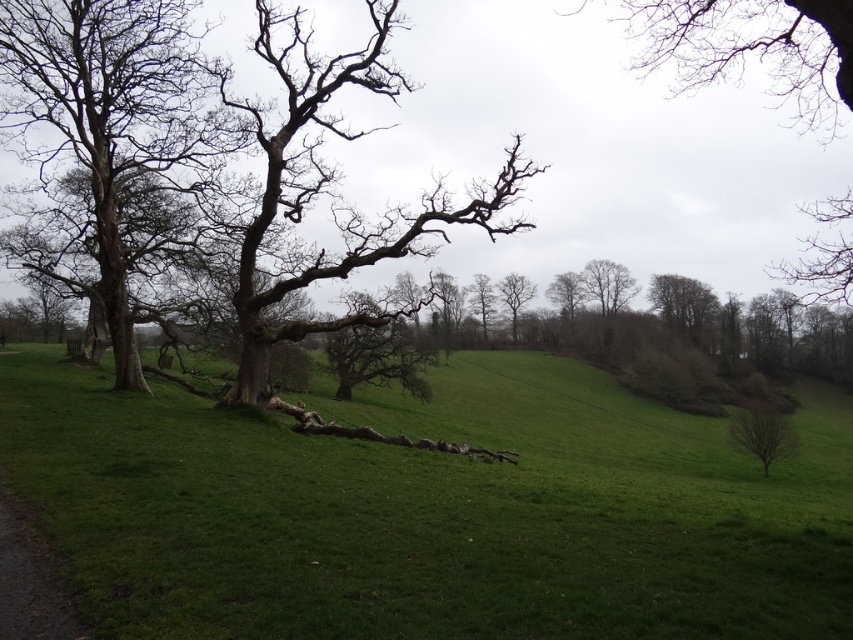
Which is in front, point (834, 273) or point (505, 282)?

Positioned in front is point (834, 273).

This screenshot has height=640, width=853. What do you see at coordinates (751, 49) in the screenshot?
I see `bare branches at upper center` at bounding box center [751, 49].

Identify the location of bare branches at upper center. (751, 49).

Is bare branches at upper center further to the viewer compared to bare branch at lower right?

No, it is in front of bare branch at lower right.

Describe the element at coordinates (751, 49) in the screenshot. I see `bare branches at upper center` at that location.

Between point (776, 84) and point (747, 449), which one is positioned behind?

The point (776, 84) is more distant.

Where is `bare branches at upper center`? bare branches at upper center is located at coordinates (751, 49).

The image size is (853, 640). In order to click on green grassy at center in this screenshot , I will do `click(432, 512)`.

Can you confirm if green grassy at center is positioned below bare branch at lower right?

No.

Describe the element at coordinates (432, 512) in the screenshot. The width and height of the screenshot is (853, 640). I see `green grassy at center` at that location.

Image resolution: width=853 pixels, height=640 pixels. I want to click on green grassy at center, so click(x=432, y=512).